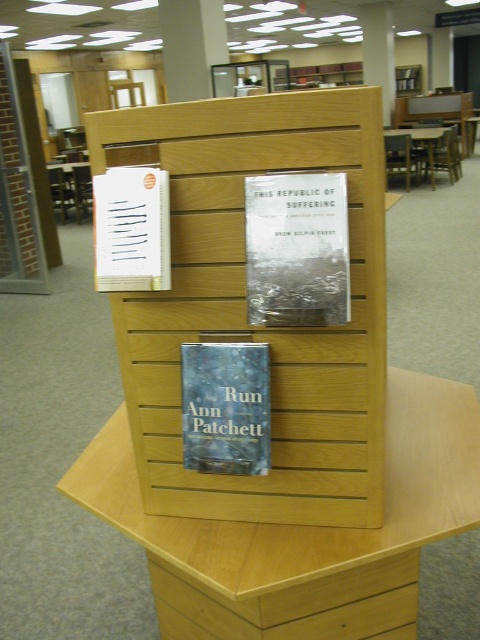
You are a librarian organizing books on a display stand. You have a small bookend that is 5 inches tall. You need to place it next to the taller object between the hardcover book at center and the white paper at upper left. Which object should you place the bookend next to?

The hardcover book at center is taller than the white paper at upper left, so you should place the bookend next to the hardcover book at center.

You are a librarian organizing books on a display. You need to place a new book between the hardcover book at center and the brown wooden table at center. Where should you place it?

Place the new book between the hardcover book at center and the brown wooden table at center, to the right of the hardcover book at center and to the left of the brown wooden table at center since the hardcover book at center is to the left of the brown wooden table at center.

You are standing in a library and see the hardcover book at center on a display stand. If you want to pick it up, will you be able to reach it without moving closer? Assume your outstretched hand can reach up to 36 inches.

The hardcover book at center is 37.56 inches away from the viewer. Since your outstretched hand can reach up to 36 inches, you will need to move closer to reach it.